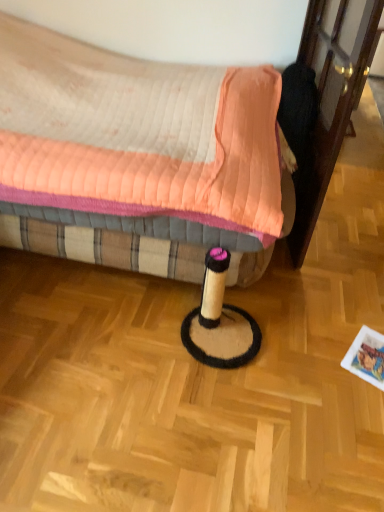
What are the coordinates of `transparent glass screen door at right` in the screenshot? It's located at (331, 97).

In order to face transparent glass screen door at right, should I rotate leftwards or rightwards?

Turn right approximately 16.303 degrees to face it.

This screenshot has width=384, height=512. Describe the element at coordinates (331, 97) in the screenshot. I see `transparent glass screen door at right` at that location.

Describe the element at coordinates (135, 157) in the screenshot. I see `quilted fabric bed at center` at that location.

The width and height of the screenshot is (384, 512). I want to click on quilted fabric bed at center, so [x=135, y=157].

Locate an element on the screen. transparent glass screen door at right is located at coordinates (331, 97).

Would you say quilted fabric bed at center is to the left or to the right of transparent glass screen door at right in the picture?

From the image, it's evident that quilted fabric bed at center is to the left of transparent glass screen door at right.

Is quilted fabric bed at center positioned in front of transparent glass screen door at right?

Yes, the depth of quilted fabric bed at center is less than that of transparent glass screen door at right.

Is point (109, 186) farther from viewer compared to point (299, 247)?

No, it is not.

From the image's perspective, is quilted fabric bed at center beneath transparent glass screen door at right?

Yes, from the image's perspective, quilted fabric bed at center is below transparent glass screen door at right.

From a real-world perspective, is quilted fabric bed at center positioned above or below transparent glass screen door at right?

In terms of real-world spatial position, quilted fabric bed at center is below transparent glass screen door at right.

Consider the image. Considering the relative sizes of quilted fabric bed at center and transparent glass screen door at right in the image provided, is quilted fabric bed at center wider than transparent glass screen door at right?

Yes.

Who is shorter, quilted fabric bed at center or transparent glass screen door at right?

quilted fabric bed at center is shorter.

Between quilted fabric bed at center and transparent glass screen door at right, which one has smaller size?

transparent glass screen door at right.

Can we say quilted fabric bed at center lies outside transparent glass screen door at right?

Indeed, quilted fabric bed at center is completely outside transparent glass screen door at right.

Is quilted fabric bed at center touching transparent glass screen door at right?

No, quilted fabric bed at center is not touching transparent glass screen door at right.

Is quilted fabric bed at center facing away from transparent glass screen door at right?

No.

Can you tell me how much quilted fabric bed at center and transparent glass screen door at right differ in facing direction?

The angle between the facing direction of quilted fabric bed at center and the facing direction of transparent glass screen door at right is 105 degrees.

How far apart are quilted fabric bed at center and transparent glass screen door at right?

27.14 inches.

Locate an element on the screen. This screenshot has height=512, width=384. bed below the transparent glass screen door at right (from the image's perspective) is located at coordinates (135, 157).

Considering the positions of objects transparent glass screen door at right and quilted fabric bed at center in the image provided, who is more to the left, transparent glass screen door at right or quilted fabric bed at center?

From the viewer's perspective, quilted fabric bed at center appears more on the left side.

Consider the image. Considering their positions, is transparent glass screen door at right located in front of or behind quilted fabric bed at center?

transparent glass screen door at right is behind quilted fabric bed at center.

Does point (379, 11) come in front of point (122, 158)?

That is True.

Based on the photo, from the image's perspective, who appears lower, transparent glass screen door at right or quilted fabric bed at center?

From the image's view, quilted fabric bed at center is below.

From a real-world perspective, is transparent glass screen door at right physically located above or below quilted fabric bed at center?

In terms of real-world spatial position, transparent glass screen door at right is above quilted fabric bed at center.

Can you confirm if transparent glass screen door at right is thinner than quilted fabric bed at center?

Yes, transparent glass screen door at right is thinner than quilted fabric bed at center.

Considering the sizes of objects transparent glass screen door at right and quilted fabric bed at center in the image provided, who is taller, transparent glass screen door at right or quilted fabric bed at center?

transparent glass screen door at right.

Considering the sizes of objects transparent glass screen door at right and quilted fabric bed at center in the image provided, who is bigger, transparent glass screen door at right or quilted fabric bed at center?

quilted fabric bed at center.

Looking at this image, is transparent glass screen door at right not within quilted fabric bed at center?

Yes.

Is transparent glass screen door at right touching quilted fabric bed at center?

No, transparent glass screen door at right is not touching quilted fabric bed at center.

Consider the image. Is transparent glass screen door at right oriented away from quilted fabric bed at center?

Correct, transparent glass screen door at right is looking away from quilted fabric bed at center.

Consider the image. How different are the orientations of transparent glass screen door at right and quilted fabric bed at center in degrees?

They differ by 105 degrees in their facing directions.

Image resolution: width=384 pixels, height=512 pixels. I want to click on bed located in front of the transparent glass screen door at right, so click(x=135, y=157).

At what (x,y) coordinates should I click in order to perform the action: click on screen door that is above the quilted fabric bed at center (from a real-world perspective). Please return your answer as a coordinate pair (x, y). This screenshot has width=384, height=512. Looking at the image, I should click on (331, 97).

You are a GUI agent. You are given a task and a screenshot of the screen. Output one action in this format:
    pyautogui.click(x=<x>, y=<y>)
    Task: Click on the bed below the transparent glass screen door at right (from a real-world perspective)
    This screenshot has height=512, width=384.
    Given the screenshot: What is the action you would take?
    pyautogui.click(x=135, y=157)